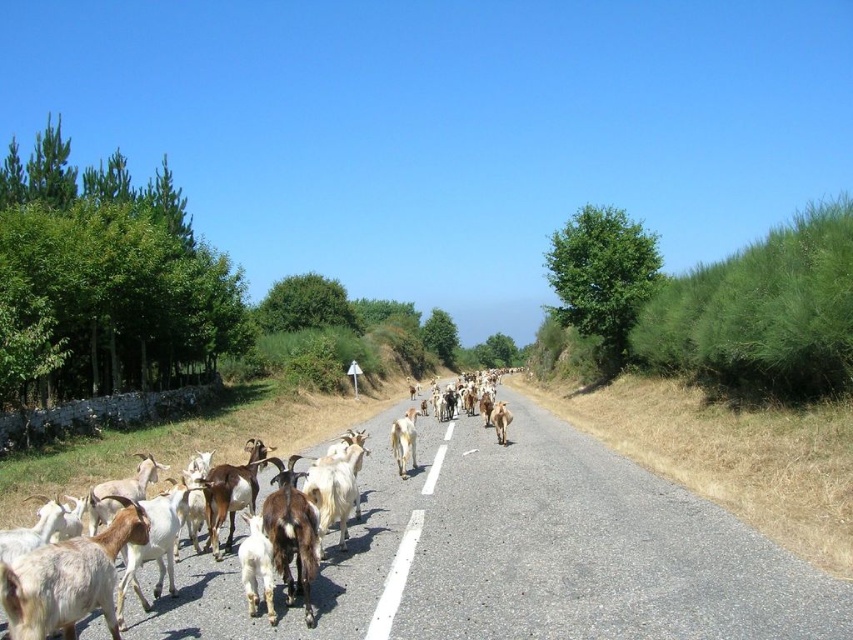
Can you confirm if asphalt road at center is positioned to the left of white woolen goats at center?

In fact, asphalt road at center is to the right of white woolen goats at center.

Can you confirm if asphalt road at center is shorter than white woolen goats at center?

Yes, asphalt road at center is shorter than white woolen goats at center.

Which is behind, point (506, 515) or point (165, 636)?

The point (506, 515) is behind.

Locate an element on the screen. The width and height of the screenshot is (853, 640). asphalt road at center is located at coordinates (582, 548).

Who is positioned more to the right, asphalt road at center or white woolen goat at center?

Positioned to the right is asphalt road at center.

How far apart are asphalt road at center and white woolen goat at center?

A distance of 3.81 meters exists between asphalt road at center and white woolen goat at center.

I want to click on asphalt road at center, so click(x=582, y=548).

Find the location of `asphalt road at center`. asphalt road at center is located at coordinates (582, 548).

Which is behind, point (397, 556) or point (33, 596)?

The point (397, 556) is more distant.

Which of these two, asphalt road at center or white woolen goat at lower left, stands taller?

white woolen goat at lower left

Is point (396, 554) more distant than point (62, 634)?

Yes.

The height and width of the screenshot is (640, 853). Find the location of `asphalt road at center`. asphalt road at center is located at coordinates (582, 548).